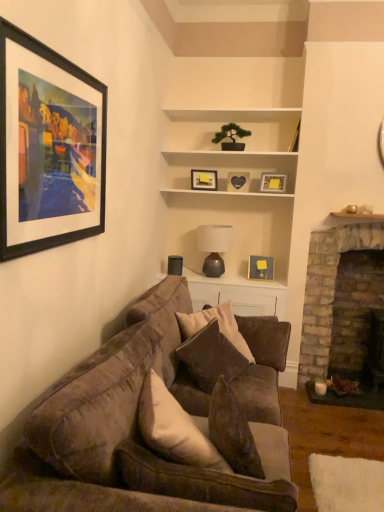
What do you see at coordinates (48, 147) in the screenshot?
I see `matte black picture frame at upper left, marked as the first picture frame in a left-to-right arrangement` at bounding box center [48, 147].

This screenshot has height=512, width=384. What do you see at coordinates (214, 247) in the screenshot?
I see `matte gray lamp at center` at bounding box center [214, 247].

This screenshot has width=384, height=512. Describe the element at coordinates (273, 183) in the screenshot. I see `matte gold picture frame at upper center, which is the 5th picture frame in left-to-right order` at that location.

Measure the distance between wooden heart at center, which is the third picture frame from back to front, and camera.

The depth of wooden heart at center, which is the third picture frame from back to front, is 11.78 feet.

Locate an element on the screen. This screenshot has height=512, width=384. wooden heart at center, the 3th picture frame positioned from the front is located at coordinates (238, 181).

Where is `velvet brown couch at center, the 2th studio couch when ordered from front to back`? This screenshot has width=384, height=512. velvet brown couch at center, the 2th studio couch when ordered from front to back is located at coordinates (263, 368).

Where is `matte black picture frame at upper left, which is the fifth picture frame in back-to-front order`? This screenshot has width=384, height=512. matte black picture frame at upper left, which is the fifth picture frame in back-to-front order is located at coordinates (48, 147).

From a real-world perspective, is matte gray lamp at center above or below velvet brown couch at center, the 1th studio couch when ordered from back to front?

Clearly, from a real-world perspective, matte gray lamp at center is above velvet brown couch at center, the 1th studio couch when ordered from back to front.

Could you tell me if matte gray lamp at center is turned towards velvet brown couch at center, the 1th studio couch when ordered from back to front?

Yes.

Which object is positioned more to the right, matte gray lamp at center or velvet brown couch at center, the 2th studio couch when ordered from front to back?

Positioned to the right is matte gray lamp at center.

From the image's perspective, would you say matte gray lamp at center is positioned over velvet brown couch at center, the 1th studio couch when ordered from back to front?

Yes, from the image's perspective, matte gray lamp at center is on top of velvet brown couch at center, the 1th studio couch when ordered from back to front.

Is matte gold picture frame at upper center, which ranks as the 4th picture frame in back-to-front order, looking in the opposite direction of matte gold picture frame at center, placed as the 5th picture frame when sorted from front to back?

matte gold picture frame at upper center, which ranks as the 4th picture frame in back-to-front order, does not have its back to matte gold picture frame at center, placed as the 5th picture frame when sorted from front to back.

Considering the relative positions of matte gold picture frame at upper center, which is the 5th picture frame in left-to-right order, and matte gold picture frame at center, marked as the 2th picture frame in a right-to-left arrangement, in the image provided, is matte gold picture frame at upper center, which is the 5th picture frame in left-to-right order, to the left of matte gold picture frame at center, marked as the 2th picture frame in a right-to-left arrangement, from the viewer's perspective?

Incorrect, matte gold picture frame at upper center, which is the 5th picture frame in left-to-right order, is not on the left side of matte gold picture frame at center, marked as the 2th picture frame in a right-to-left arrangement.

From the image's perspective, is matte gold picture frame at upper center, positioned as the second picture frame in front-to-back order, below matte gold picture frame at center, which ranks as the 1th picture frame in back-to-front order?

No, from the image's perspective, matte gold picture frame at upper center, positioned as the second picture frame in front-to-back order, is not beneath matte gold picture frame at center, which ranks as the 1th picture frame in back-to-front order.

Is matte gold picture frame at upper center, marked as the 1th picture frame in a right-to-left arrangement, completely or partially outside of matte gold picture frame at center, placed as the 5th picture frame when sorted from front to back?

Yes, matte gold picture frame at upper center, marked as the 1th picture frame in a right-to-left arrangement, is not within matte gold picture frame at center, placed as the 5th picture frame when sorted from front to back.

Is velvet brown pillow at center facing towards velvet brown couch at center, the 2th studio couch when ordered from front to back?

Yes, velvet brown pillow at center is oriented towards velvet brown couch at center, the 2th studio couch when ordered from front to back.

How different are the orientations of velvet brown pillow at center and velvet brown couch at center, the 1th studio couch when ordered from back to front, in degrees?

5.09 degrees.

Which object is more forward, velvet brown pillow at center or velvet brown couch at center, the 2th studio couch when ordered from front to back?

velvet brown pillow at center is more forward.

Are velvet brown pillow at center and velvet brown couch at center, the 1th studio couch when ordered from back to front, far apart?

No, there isn't a large distance between velvet brown pillow at center and velvet brown couch at center, the 1th studio couch when ordered from back to front.

Which of these two, white matte cabinet at center or matte gold picture frame at center, acting as the 4th picture frame starting from the left, is smaller?

matte gold picture frame at center, acting as the 4th picture frame starting from the left, is smaller.

Looking at this image, considering the relative positions of white matte cabinet at center and matte gold picture frame at center, placed as the 5th picture frame when sorted from front to back, in the image provided, is white matte cabinet at center to the left or to the right of matte gold picture frame at center, placed as the 5th picture frame when sorted from front to back,?

Based on their positions, white matte cabinet at center is located to the left of matte gold picture frame at center, placed as the 5th picture frame when sorted from front to back.

From the image's perspective, which is below, white matte cabinet at center or matte gold picture frame at center, which ranks as the 1th picture frame in back-to-front order?

From the image's view, matte gold picture frame at center, which ranks as the 1th picture frame in back-to-front order, is below.

From the image's perspective, which one is positioned higher, green matte bonsai tree at upper center or velvet brown pillow at center?

green matte bonsai tree at upper center is shown above in the image.

This screenshot has height=512, width=384. Identify the location of pillow on the left of green matte bonsai tree at upper center. (210, 357).

Which object is positioned more to the left, green matte bonsai tree at upper center or velvet brown pillow at center?

Positioned to the left is velvet brown pillow at center.

Are green matte bonsai tree at upper center and velvet brown pillow at center far apart?

Yes.

Considering the sizes of matte black picture frame at center, marked as the second picture frame in a back-to-front arrangement, and matte gold picture frame at center, marked as the 2th picture frame in a right-to-left arrangement, in the image, is matte black picture frame at center, marked as the second picture frame in a back-to-front arrangement, bigger or smaller than matte gold picture frame at center, marked as the 2th picture frame in a right-to-left arrangement,?

Considering their sizes, matte black picture frame at center, marked as the second picture frame in a back-to-front arrangement, takes up less space than matte gold picture frame at center, marked as the 2th picture frame in a right-to-left arrangement.

From the image's perspective, is matte black picture frame at center, the 4th picture frame positioned from the right, above or below matte gold picture frame at center, which ranks as the 1th picture frame in back-to-front order?

matte black picture frame at center, the 4th picture frame positioned from the right, is situated higher than matte gold picture frame at center, which ranks as the 1th picture frame in back-to-front order, in the image.

How different are the orientations of matte black picture frame at center, the 4th picture frame positioned from the right, and matte gold picture frame at center, which ranks as the 1th picture frame in back-to-front order, in degrees?

The angular difference between matte black picture frame at center, the 4th picture frame positioned from the right, and matte gold picture frame at center, which ranks as the 1th picture frame in back-to-front order, is 19.7 degrees.

Which object is wider, matte black picture frame at center, the 4th picture frame positioned from the right, or matte gold picture frame at center, which ranks as the 1th picture frame in back-to-front order?

matte gold picture frame at center, which ranks as the 1th picture frame in back-to-front order, is wider.

Based on the photo, can you confirm if matte gold picture frame at upper center, positioned as the second picture frame in front-to-back order, is thinner than white matte cabinet at center?

Indeed, matte gold picture frame at upper center, positioned as the second picture frame in front-to-back order, has a lesser width compared to white matte cabinet at center.

From a real-world perspective, is matte gold picture frame at upper center, positioned as the second picture frame in front-to-back order, physically below white matte cabinet at center?

Indeed, from a real-world perspective, matte gold picture frame at upper center, positioned as the second picture frame in front-to-back order, is positioned beneath white matte cabinet at center.

Is matte gold picture frame at upper center, marked as the 1th picture frame in a right-to-left arrangement, at the right side of white matte cabinet at center?

Correct, you'll find matte gold picture frame at upper center, marked as the 1th picture frame in a right-to-left arrangement, to the right of white matte cabinet at center.

Is matte gold picture frame at upper center, positioned as the second picture frame in front-to-back order, turned away from white matte cabinet at center?

Correct, matte gold picture frame at upper center, positioned as the second picture frame in front-to-back order, is looking away from white matte cabinet at center.

Locate an element on the screen. the 1st studio couch in front of the matte gray lamp at center, counting from the anchor's position is located at coordinates (263, 368).

The width and height of the screenshot is (384, 512). There is a matte gold picture frame at center, placed as the 5th picture frame when sorted from front to back. Find the location of `the 1st picture frame above it (from a real-world perspective)`. the 1st picture frame above it (from a real-world perspective) is located at coordinates (273, 183).

Based on their spatial positions, is wooden heart at center, acting as the 3th picture frame starting from the right, or matte gold picture frame at upper center, marked as the 1th picture frame in a right-to-left arrangement, further from velvet brown couch at lower left, which is counted as the second studio couch, starting from the back?

wooden heart at center, acting as the 3th picture frame starting from the right, lies further to velvet brown couch at lower left, which is counted as the second studio couch, starting from the back, than the other object.

From the picture: Estimate the real-world distances between objects in this image. Which object is further from matte gray lamp at center, wooden heart at center, which is the third picture frame from back to front, or matte gold picture frame at center, marked as the 2th picture frame in a right-to-left arrangement?

wooden heart at center, which is the third picture frame from back to front, is positioned further to the anchor matte gray lamp at center.

Which object lies further to the anchor point velvet brown couch at lower left, which is counted as the second studio couch, starting from the back, matte black picture frame at upper left, positioned as the fifth picture frame in right-to-left order, or wooden heart at center, the 3th picture frame positioned from the front?

wooden heart at center, the 3th picture frame positioned from the front.

Which object lies further to the anchor point matte black picture frame at center, the second picture frame from the left, velvet brown couch at lower left, which is counted as the second studio couch, starting from the back, or wooden heart at center, which is the third picture frame from back to front?

velvet brown couch at lower left, which is counted as the second studio couch, starting from the back, is further to matte black picture frame at center, the second picture frame from the left.

From the image, which object appears to be farther from wooden heart at center, acting as the 3th picture frame starting from the right, velvet brown couch at center, the 1th studio couch when ordered from back to front, or green matte bonsai tree at upper center?

The object further to wooden heart at center, acting as the 3th picture frame starting from the right, is velvet brown couch at center, the 1th studio couch when ordered from back to front.

Based on their spatial positions, is matte black picture frame at upper left, which is the fifth picture frame in back-to-front order, or green matte bonsai tree at upper center further from brick fireplace at right?

Based on the image, matte black picture frame at upper left, which is the fifth picture frame in back-to-front order, appears to be further to brick fireplace at right.

From the image, which object appears to be farther from velvet brown couch at lower left, which appears as the first studio couch when viewed from the front, matte gold picture frame at center, placed as the 5th picture frame when sorted from front to back, or matte black picture frame at center, marked as the second picture frame in a back-to-front arrangement?

matte black picture frame at center, marked as the second picture frame in a back-to-front arrangement, lies further to velvet brown couch at lower left, which appears as the first studio couch when viewed from the front, than the other object.

Consider the image. When comparing their distances from green matte bonsai tree at upper center, does velvet brown couch at center, the 1th studio couch when ordered from back to front, or matte black picture frame at center, marked as the second picture frame in a back-to-front arrangement, seem further?

The object further to green matte bonsai tree at upper center is velvet brown couch at center, the 1th studio couch when ordered from back to front.

Where is `pillow positioned between velvet brown couch at lower left, which appears as the first studio couch when viewed from the front, and matte black picture frame at center, the 4th picture frame positioned from the right, from near to far`? Image resolution: width=384 pixels, height=512 pixels. pillow positioned between velvet brown couch at lower left, which appears as the first studio couch when viewed from the front, and matte black picture frame at center, the 4th picture frame positioned from the right, from near to far is located at coordinates (210, 357).

Where is `lamp between matte black picture frame at upper left, acting as the 1th picture frame starting from the front, and matte black picture frame at center, the 4th picture frame positioned from the right, from front to back`? The height and width of the screenshot is (512, 384). lamp between matte black picture frame at upper left, acting as the 1th picture frame starting from the front, and matte black picture frame at center, the 4th picture frame positioned from the right, from front to back is located at coordinates (214, 247).

Where is `fireplace between white matte cabinet at center and velvet brown pillow at center vertically`? The height and width of the screenshot is (512, 384). fireplace between white matte cabinet at center and velvet brown pillow at center vertically is located at coordinates (327, 290).

Where is `pillow positioned between matte black picture frame at upper left, acting as the 1th picture frame starting from the front, and matte gold picture frame at center, which ranks as the 1th picture frame in back-to-front order, from near to far`? The width and height of the screenshot is (384, 512). pillow positioned between matte black picture frame at upper left, acting as the 1th picture frame starting from the front, and matte gold picture frame at center, which ranks as the 1th picture frame in back-to-front order, from near to far is located at coordinates (210, 357).